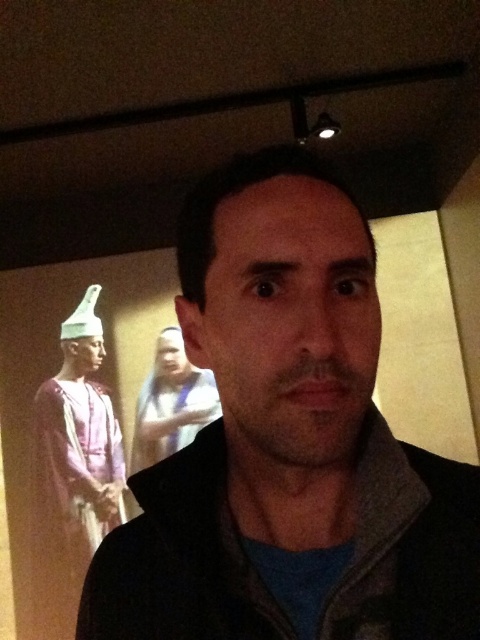
Is point (437, 476) positioned after point (60, 515)?

No, it is not.

Does black fleece jacket at center appear over matte purple fabric at left?

Indeed, black fleece jacket at center is positioned over matte purple fabric at left.

You are a GUI agent. You are given a task and a screenshot of the screen. Output one action in this format:
    pyautogui.click(x=<x>, y=<y>)
    Task: Click on the black fleece jacket at center
    
    Given the screenshot: What is the action you would take?
    pyautogui.click(x=180, y=561)

Is point (233, 484) behind point (156, 342)?

No, (233, 484) is closer to viewer.

The image size is (480, 640). I want to click on matte black jacket at center, so click(x=288, y=444).

Between matte purple fabric at left and smooth beige scarf at center, which one appears on the left side from the viewer's perspective?

Positioned to the left is matte purple fabric at left.

Is point (35, 516) closer to camera compared to point (173, 349)?

No, it is not.

Which is behind, point (103, 499) or point (176, 417)?

The point (103, 499) is more distant.

Image resolution: width=480 pixels, height=640 pixels. I want to click on matte purple fabric at left, so click(74, 467).